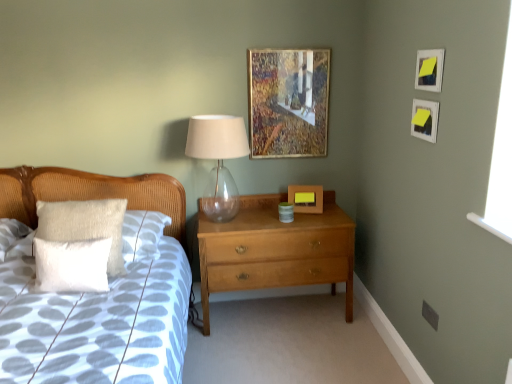
Question: Do you think transparent glass table lamp at center is within yellow paper at upper right, acting as the 1th picture frame starting from the front, or outside of it?

Choices:
 (A) outside
 (B) inside

Answer: (A)

Question: Considering their positions, is transparent glass table lamp at center located in front of or behind yellow paper at upper right, acting as the 1th picture frame starting from the front?

Choices:
 (A) behind
 (B) front

Answer: (A)

Question: Which of these objects is positioned farthest from the white textured pillow at left, placed as the second pillow when sorted from back to front?

Choices:
 (A) wooden picture frame at upper center, positioned as the 3th picture frame in front-to-back order
 (B) matte white picture frame at upper right, acting as the first picture frame starting from the right
 (C) transparent glass table lamp at center
 (D) white soft pillow at left
 (E) light brown wood chest of drawers at center

Answer: (B)

Question: Which is farther from the wooden picture frame at upper center, which appears as the 1th picture frame when viewed from the left?

Choices:
 (A) light brown wood chest of drawers at center
 (B) yellow paper at upper right, the second picture frame positioned from the right
 (C) transparent glass table lamp at center
 (D) matte white picture frame at upper right, which is the 2th picture frame from front to back
 (E) wooden picture frame at center, which is the first picture frame in back-to-front order

Answer: (B)